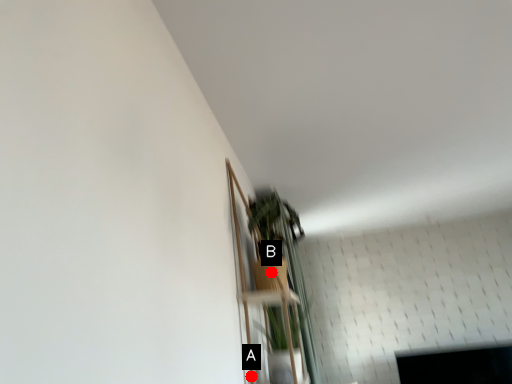
Question: Two points are circled on the image, labeled by A and B beside each circle. Which point is further to the camera?

Choices:
 (A) A is further
 (B) B is further

Answer: (A)